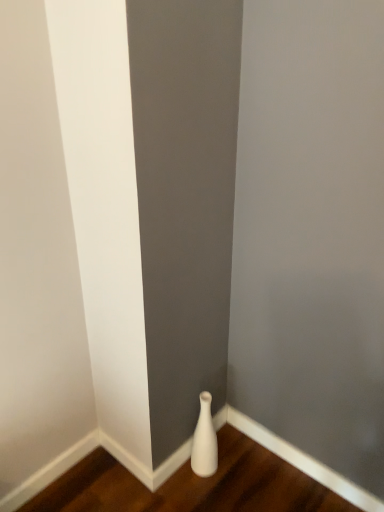
The image size is (384, 512). In order to click on vacant space that is to the left of white matte vase at lower right in this screenshot , I will do (167, 483).